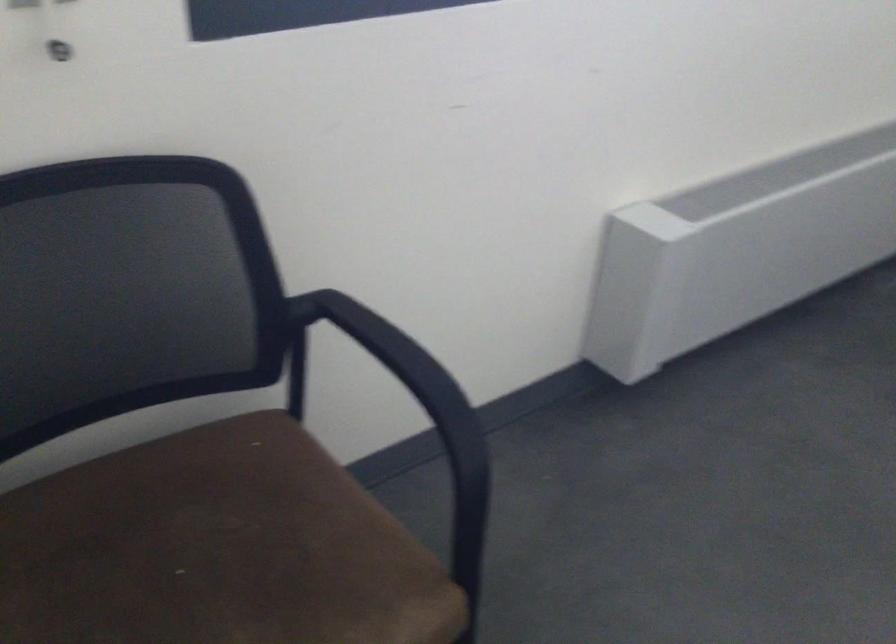
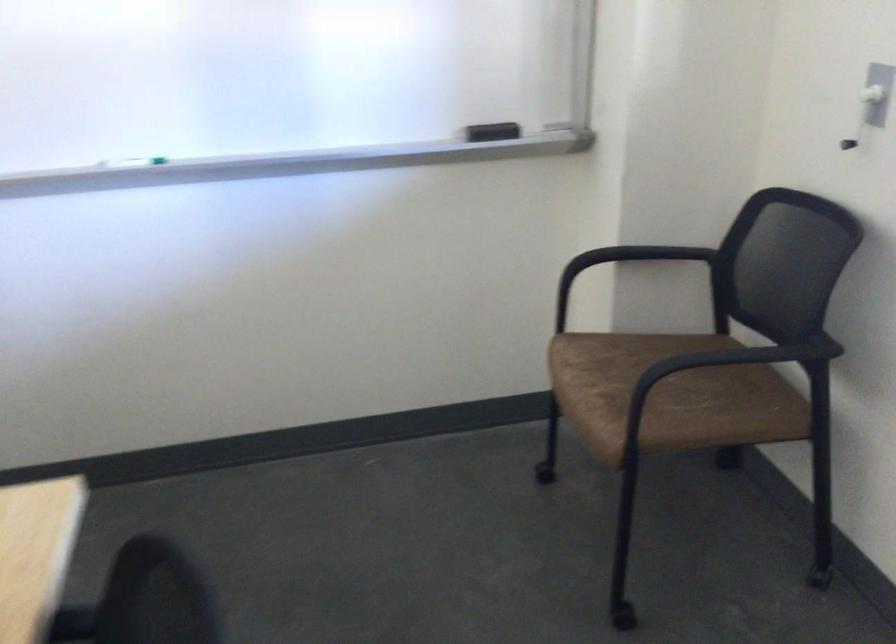
Locate, in the second image, the point that corresponds to [230,563] in the first image.

(669, 395)